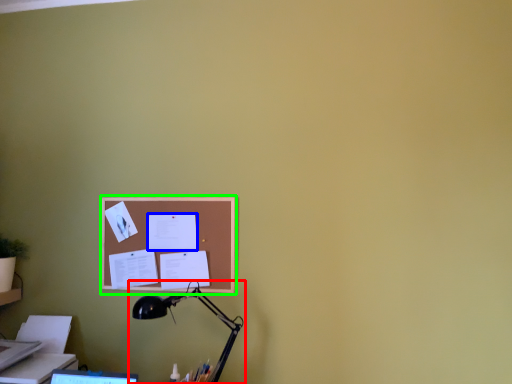
Question: Considering the real-world distances, which object is farthest from lamp (highlighted by a red box)? paper (highlighted by a blue box) or bulletin board (highlighted by a green box)?

Choices:
 (A) paper
 (B) bulletin board

Answer: (A)